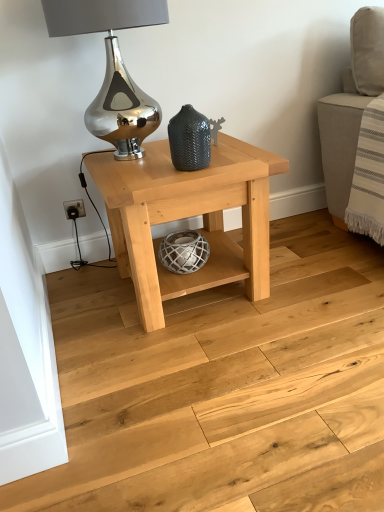
The height and width of the screenshot is (512, 384). I want to click on free region on the left part of matte dark gray textured vase at center, so click(x=153, y=173).